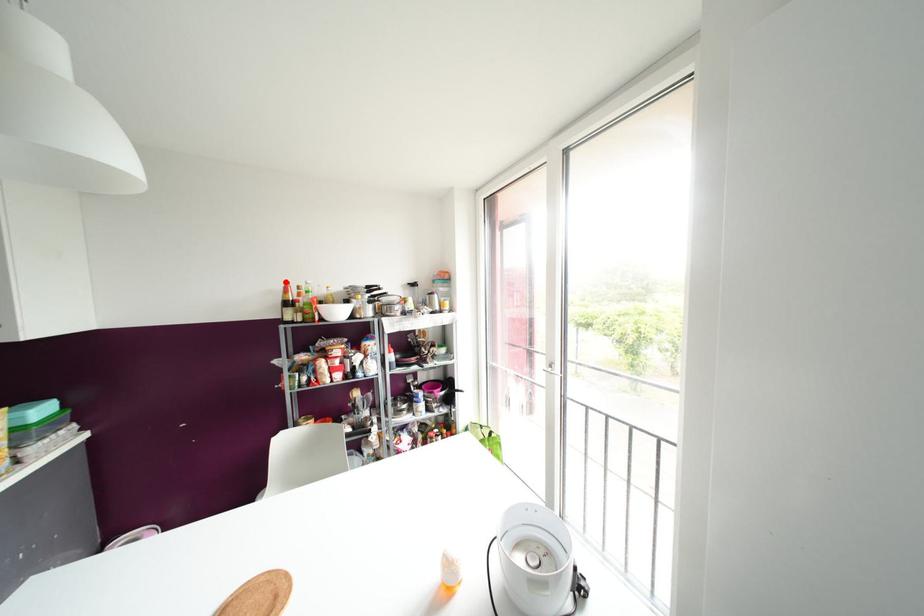
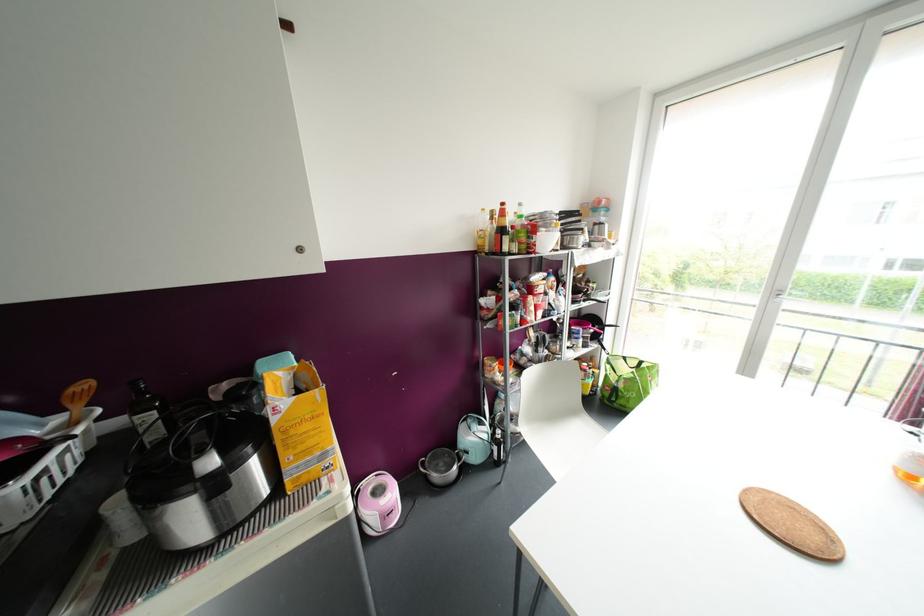
The point at the highlighted location is marked in the first image. Where is the corresponding point in the second image?

(502, 204)